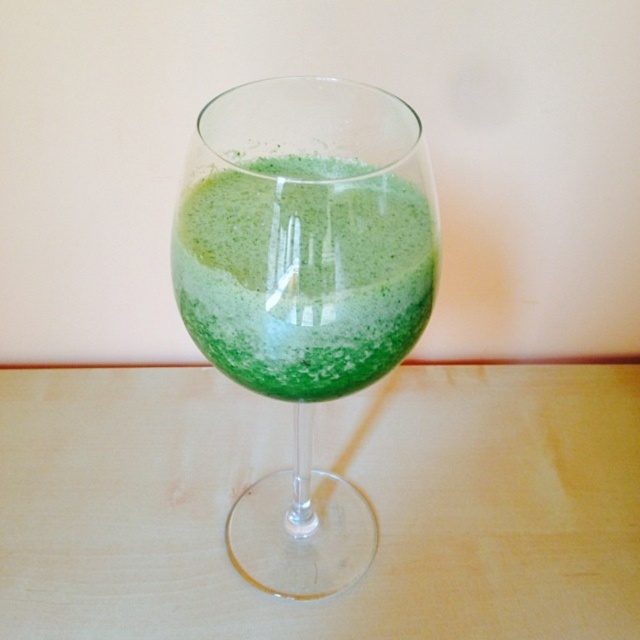
You are arranging items on a table and need to place both the green glass at center and the green translucent wine glass at center. According to the image, which one is positioned to the right of the other?

The green glass at center is to the right of the green translucent wine glass at center.

You are a bartender preparing a drink. You have a green translucent wine glass at center and green frothy liquid at center. Which object is larger in size?

The green translucent wine glass at center is bigger than green frothy liquid at center.

From the picture: You are a robot trying to pick up the green translucent wine glass at center. The point you need to avoid is point (305, 291). Where should you avoid touching the glass?

The point (305, 291) is on the green translucent wine glass at center, so you should avoid touching that specific point on the glass to prevent interference.